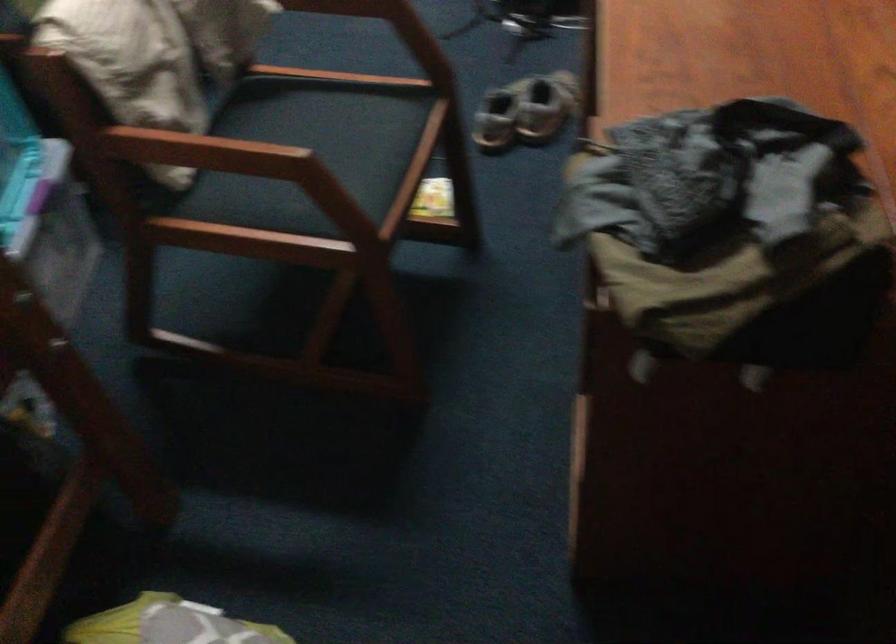
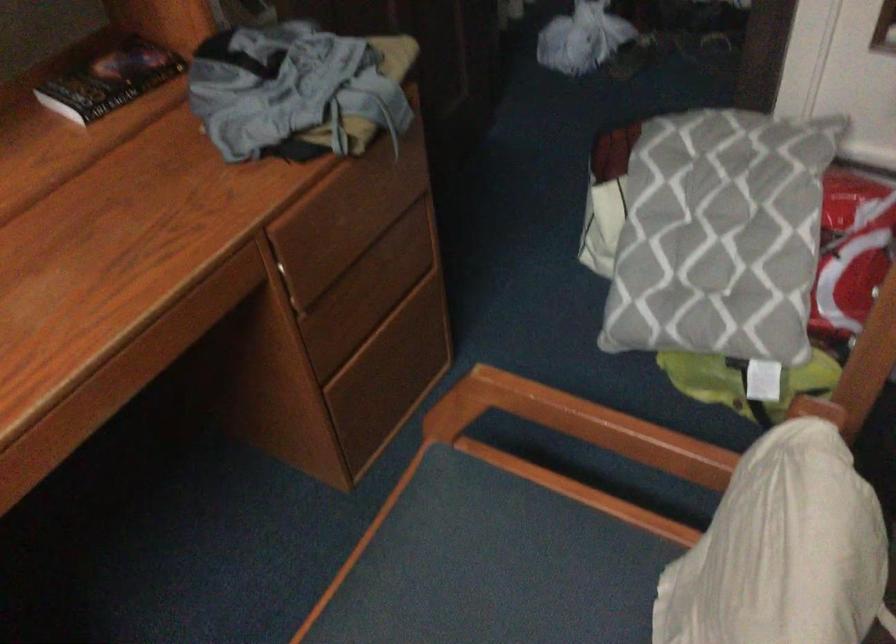
In the second image, find the point that corresponds to [280,166] in the first image.

(579, 424)